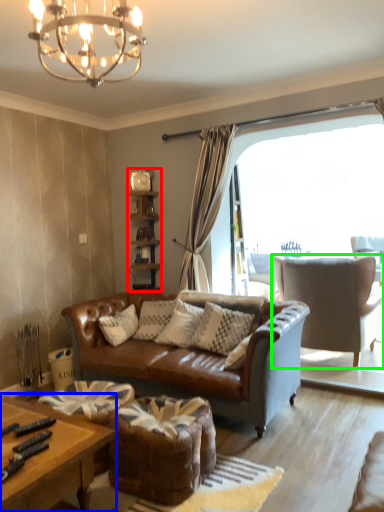
Question: Estimate the real-world distances between objects in this image. Which object is farther from shelf (highlighted by a red box), coffee table (highlighted by a blue box) or chair (highlighted by a green box)?

Choices:
 (A) coffee table
 (B) chair

Answer: (A)